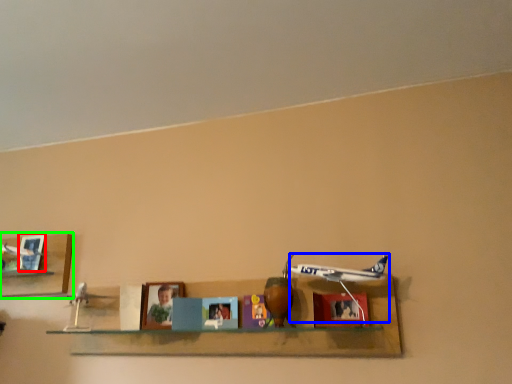
Question: Which object is the farthest from picture frame (highlighted by a red box)? Choose among these: plane (highlighted by a blue box) or shelf (highlighted by a green box).

Choices:
 (A) plane
 (B) shelf

Answer: (A)